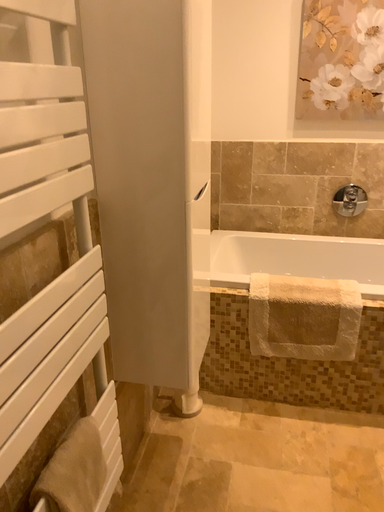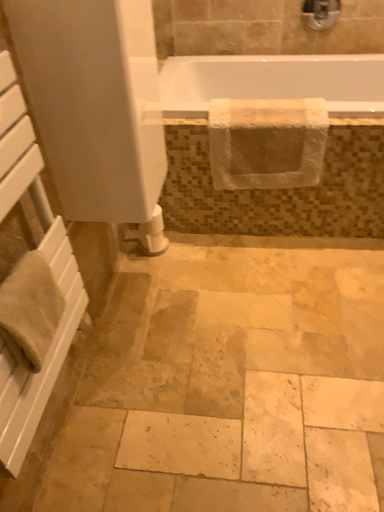
Question: Which way did the camera rotate in the video?

Choices:
 (A) rotated downward
 (B) rotated upward

Answer: (A)